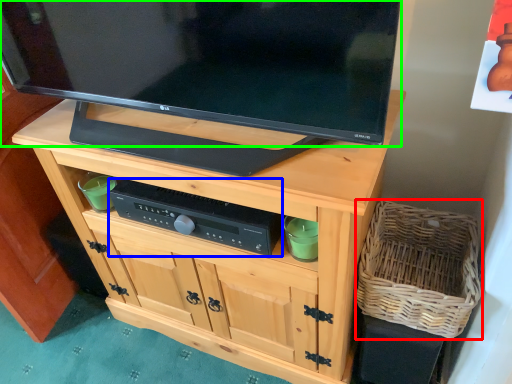
Question: Estimate the real-world distances between objects in this image. Which object is farther from basket (highlighted by a red box), control (highlighted by a blue box) or television (highlighted by a green box)?

Choices:
 (A) control
 (B) television

Answer: (B)